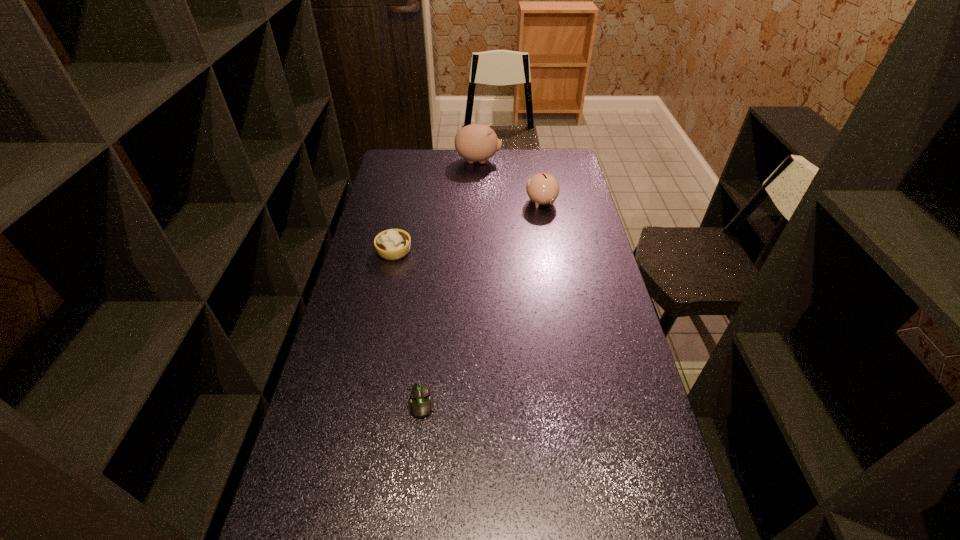
In order to click on free space that satisfies the following two spatial constraints: 1. at the snout of the left piggy bank; 2. on the left side of the nearer piggy bank in this screenshot , I will do `click(478, 202)`.